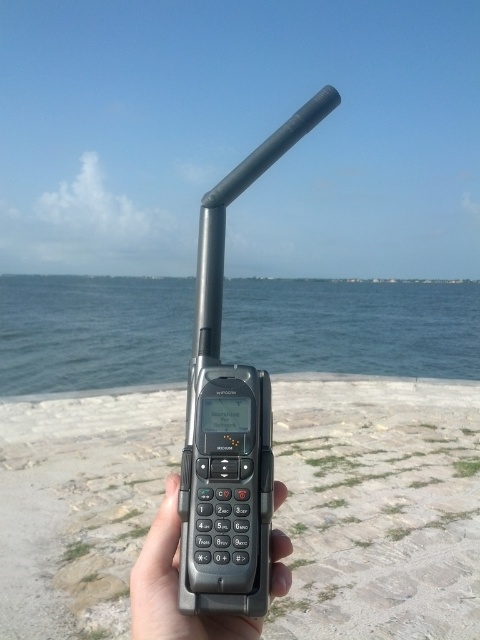
You are a photographer trying to capture the entire scene of the blue water at center and the black matte phone at center in one frame. Based on their widths, which object will occupy more space horizontally in the photo?

The blue water at center has a greater width than the black matte phone at center, so it will occupy more horizontal space in the photo.

Looking at this image, you are standing on the gray stone beach at center and want to place your black plastic phone at center somewhere. Where should you put it so that the phone is above the beach?

You should place the black plastic phone at center above the gray stone beach at center since the gray stone beach at center is positioned under the black plastic phone at center.

You are standing on the gray stone beach at center. Looking towards the satellite phone in your hand, which direction should you face to ensure the phone has an unobstructed view of the sky for better network connection?

You should face away from the gray stone beach at center so that the satellite phone has an unobstructed view of the sky. Since the gray stone beach at center is located at point [377,508], facing away from it would direct the phone towards the open sky, likely improving the connection.